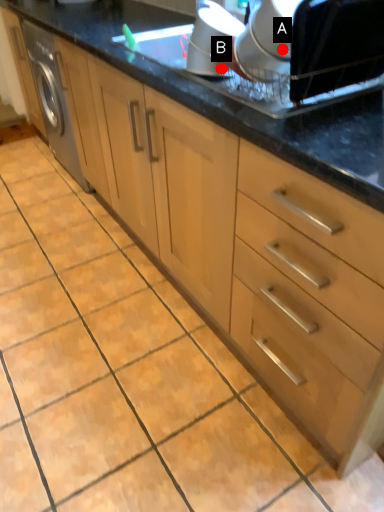
Question: Two points are circled on the image, labeled by A and B beside each circle. Which of the following is the closest to the observer?

Choices:
 (A) A is closer
 (B) B is closer

Answer: (A)